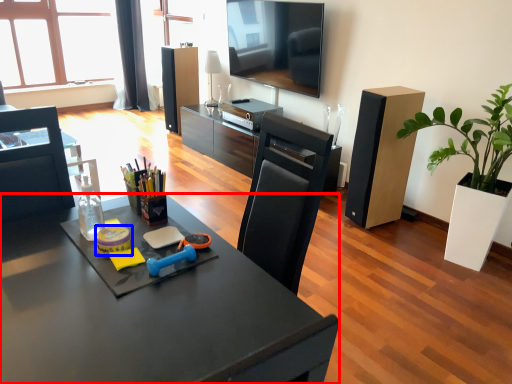
Question: Which object appears closest to the camera in this image, desk (highlighted by a red box) or stationery (highlighted by a blue box)?

Choices:
 (A) desk
 (B) stationery

Answer: (A)